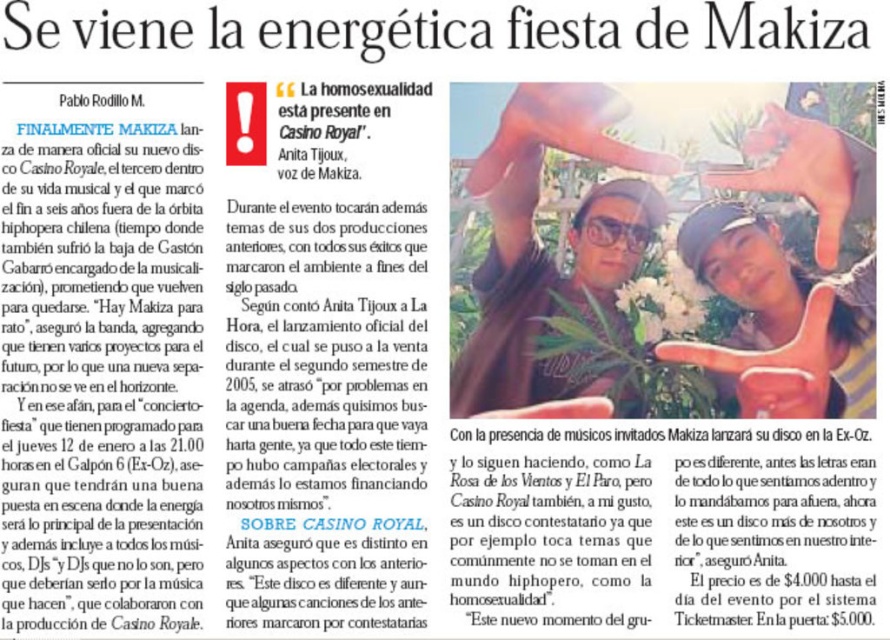
Question: Does matte black cap at upper right appear over matte black sunglasses at center?

Choices:
 (A) yes
 (B) no

Answer: (A)

Question: Is matte black cap at upper right further to the viewer compared to matte black sunglasses at center?

Choices:
 (A) no
 (B) yes

Answer: (A)

Question: Is matte black cap at upper right to the right of matte black sunglasses at center from the viewer's perspective?

Choices:
 (A) no
 (B) yes

Answer: (B)